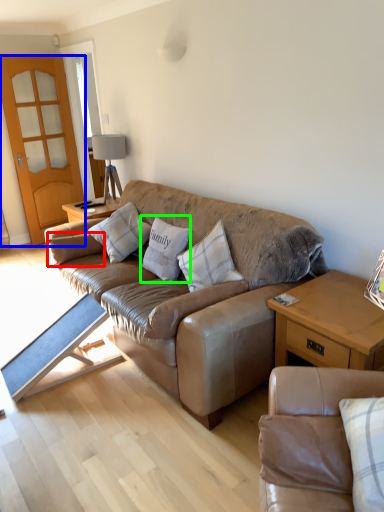
Question: Based on their relative distances, which object is farther from pillow (highlighted by a red box)? Choose from screen door (highlighted by a blue box) and pillow (highlighted by a green box).

Choices:
 (A) screen door
 (B) pillow

Answer: (A)